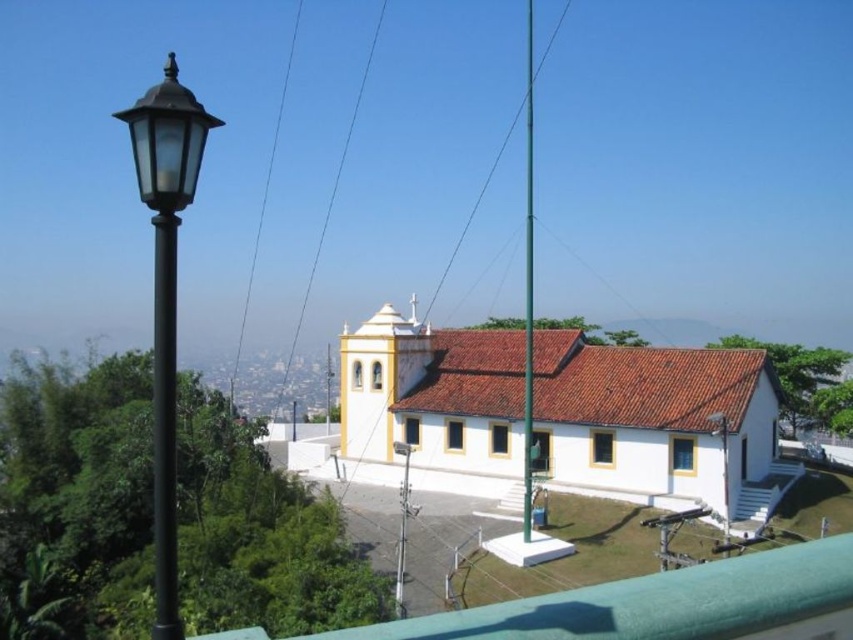
You are a city planner reviewing the layout of a new public square. You notice the green metallic pole at center and the matte black street light at upper left. Which object would require more space in terms of physical dimensions if you were to replace them with identical replicas?

The green metallic pole at center requires more space because it is larger in size than the matte black street light at upper left according to the description.

You are a photographer planning to take a photo of the church. You want to ensure both the black metal pole at left and the matte black street light at upper left are visible in the frame. Based on their positions, which object should you position closer to the left edge of your camera viewfinder to include both in the shot?

Since the black metal pole at left is to the left of the matte black street light at upper left, you should position the black metal pole at left closer to the left edge of your camera viewfinder to ensure both objects are included in the frame.

You are standing in front of the church and see the black metal pole at left and the green metallic pole at center. Which pole is closer to you?

The black metal pole at left is closer to you because it is in front of the green metallic pole at center.